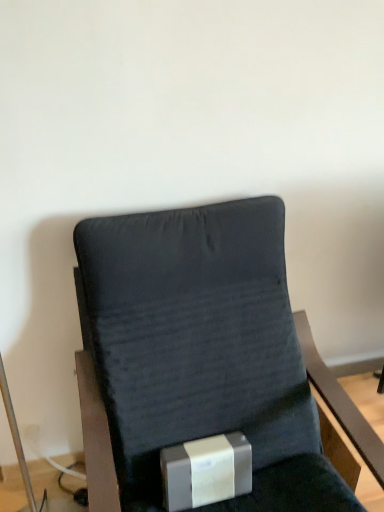
Question: Is dark fabric chair at center positioned beyond the bounds of silver metallic box at lower center?

Choices:
 (A) no
 (B) yes

Answer: (B)

Question: Is dark fabric chair at center shorter than silver metallic box at lower center?

Choices:
 (A) yes
 (B) no

Answer: (B)

Question: From the image's perspective, is dark fabric chair at center located beneath silver metallic box at lower center?

Choices:
 (A) no
 (B) yes

Answer: (A)

Question: Does dark fabric chair at center have a lesser width compared to silver metallic box at lower center?

Choices:
 (A) no
 (B) yes

Answer: (A)

Question: Considering the relative sizes of dark fabric chair at center and silver metallic box at lower center in the image provided, is dark fabric chair at center taller than silver metallic box at lower center?

Choices:
 (A) yes
 (B) no

Answer: (A)

Question: Are dark fabric chair at center and silver metallic box at lower center beside each other?

Choices:
 (A) yes
 (B) no

Answer: (B)

Question: From the image's perspective, is silver metallic box at lower center over dark fabric chair at center?

Choices:
 (A) yes
 (B) no

Answer: (B)

Question: Are silver metallic box at lower center and dark fabric chair at center located far from each other?

Choices:
 (A) yes
 (B) no

Answer: (B)

Question: Considering the relative positions of silver metallic box at lower center and dark fabric chair at center in the image provided, is silver metallic box at lower center in front of dark fabric chair at center?

Choices:
 (A) no
 (B) yes

Answer: (A)

Question: Can you confirm if silver metallic box at lower center is shorter than dark fabric chair at center?

Choices:
 (A) yes
 (B) no

Answer: (A)

Question: Considering the relative positions of silver metallic box at lower center and dark fabric chair at center in the image provided, is silver metallic box at lower center to the left of dark fabric chair at center from the viewer's perspective?

Choices:
 (A) no
 (B) yes

Answer: (B)

Question: Is silver metallic box at lower center oriented towards dark fabric chair at center?

Choices:
 (A) yes
 (B) no

Answer: (A)

Question: Looking at the image, does dark fabric chair at center seem bigger or smaller compared to silver metallic box at lower center?

Choices:
 (A) big
 (B) small

Answer: (A)